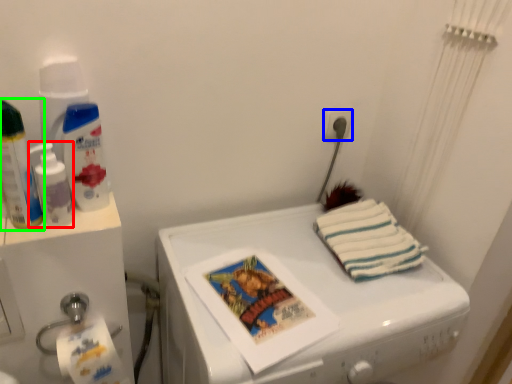
Question: Based on their relative distances, which object is nearer to cleaning product (highlighted by a red box)? Choose from power plugs and sockets (highlighted by a blue box) and bottle (highlighted by a green box).

Choices:
 (A) power plugs and sockets
 (B) bottle

Answer: (B)